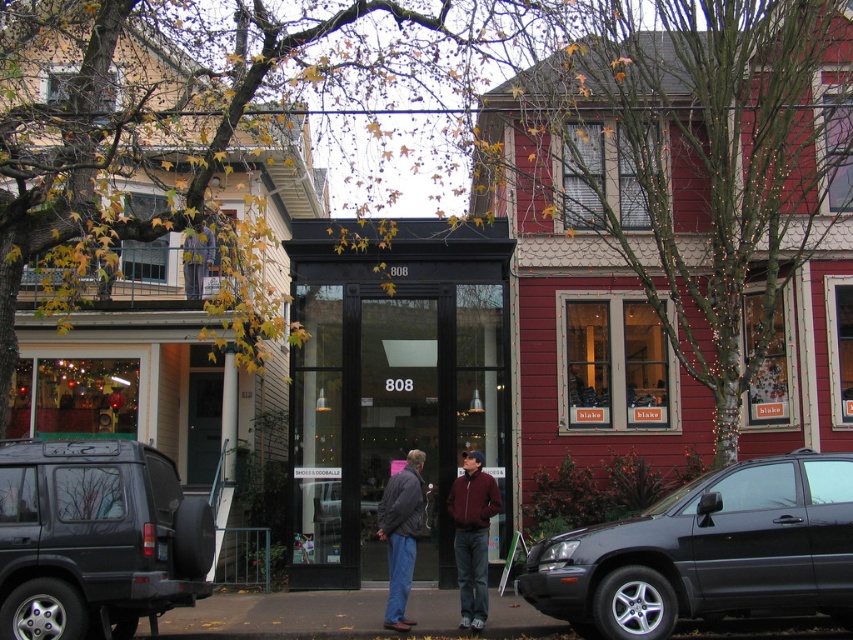
You are a delivery person trying to deliver a package to the black glass storefront at center. There is a matte black suv at lower left blocking the entrance. Can you still access the storefront entrance?

The matte black suv at lower left is behind the black glass storefront at center, so the suv is not blocking the entrance. You can still access the storefront entrance.

Based on the photo, you are a delivery person standing at the entrance of the building with the number 808. You need to place a package that is 1.5 meters long on the ground between the matte black suv at lower left and the maroon fabric jacket at center. Is there enough space between them to fit the package?

The distance between the matte black suv at lower left and the maroon fabric jacket at center is 3.62 meters. Since the package is 1.5 meters long, there is sufficient space to place it between them.